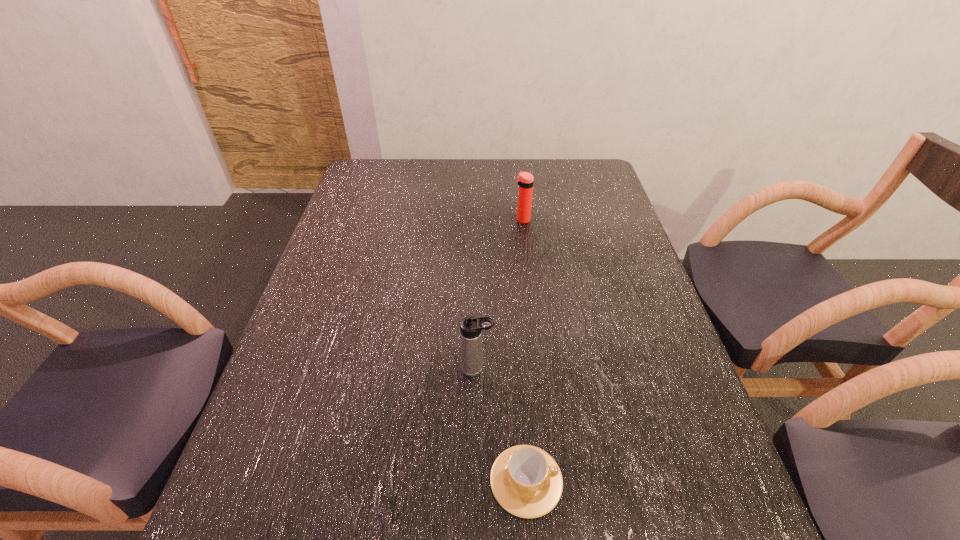
The height and width of the screenshot is (540, 960). What are the coordinates of `the farthest object` in the screenshot? It's located at (525, 180).

Identify the location of the farther thermos bottle. (525, 180).

I want to click on the left thermos bottle, so click(471, 327).

The image size is (960, 540). In order to click on the second farthest object in this screenshot , I will do `click(471, 327)`.

This screenshot has width=960, height=540. Identify the location of the nearest object. (526, 481).

In order to click on the shortest object in this screenshot , I will do `click(526, 481)`.

Locate an element on the screen. The width and height of the screenshot is (960, 540). blank area located 0.310m on the left of the farthest object is located at coordinates (419, 220).

Locate an element on the screen. This screenshot has width=960, height=540. vacant area situated on the handle side of the second farthest object is located at coordinates (564, 369).

At what (x,y) coordinates should I click in order to perform the action: click on blank space located with the handle on the side of the cup. Please return your answer as a coordinate pair (x, y). The image size is (960, 540). Looking at the image, I should click on (729, 481).

Where is `free space at the far edge of the desktop`? free space at the far edge of the desktop is located at coordinates (453, 170).